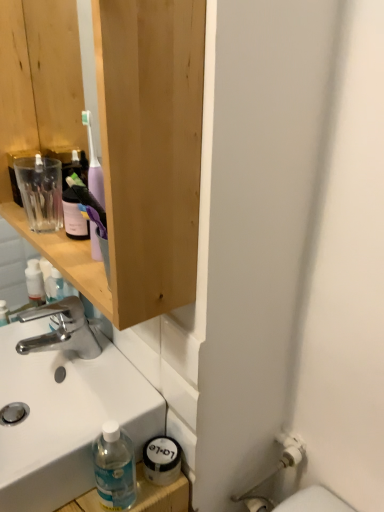
You are a GUI agent. You are given a task and a screenshot of the screen. Output one action in this format:
    pyautogui.click(x=<x>, y=<y>)
    Task: Click on the polished chrome faucet at center
    This screenshot has width=384, height=512.
    Given the screenshot: What is the action you would take?
    click(61, 330)

This screenshot has height=512, width=384. I want to click on white glossy sink at lower left, so click(65, 415).

Image resolution: width=384 pixels, height=512 pixels. Describe the element at coordinates (115, 139) in the screenshot. I see `wooden cabinet at upper left` at that location.

You are a GUI agent. You are given a task and a screenshot of the screen. Output one action in this format:
    pyautogui.click(x=<x>, y=<y>)
    Task: Click on the polished chrome faucet at center
    The width and height of the screenshot is (384, 512).
    Given the screenshot: What is the action you would take?
    pyautogui.click(x=61, y=330)

Is polished chrome faucet at center positioned beyond the bounds of wooden cabinet at upper left?

Indeed, polished chrome faucet at center is completely outside wooden cabinet at upper left.

Is polished chrome faucet at center wider than wooden cabinet at upper left?

In fact, polished chrome faucet at center might be narrower than wooden cabinet at upper left.

Is polished chrome faucet at center in contact with wooden cabinet at upper left?

polished chrome faucet at center and wooden cabinet at upper left are not in contact.

Is polished chrome faucet at center to the left of white glossy sink at lower left from the viewer's perspective?

In fact, polished chrome faucet at center is to the right of white glossy sink at lower left.

Considering the relative positions of polished chrome faucet at center and white glossy sink at lower left in the image provided, is polished chrome faucet at center in front of white glossy sink at lower left?

No, polished chrome faucet at center is further to the viewer.

In the scene shown: From the image's perspective, which object appears higher, polished chrome faucet at center or white glossy sink at lower left?

polished chrome faucet at center is shown above in the image.

Is white glossy sink at lower left at the back of polished chrome faucet at center?

That's not correct — polished chrome faucet at center is not looking away from white glossy sink at lower left.

Considering the positions of objects white glossy sink at lower left and wooden cabinet at upper left in the image provided, who is more to the right, white glossy sink at lower left or wooden cabinet at upper left?

Positioned to the right is wooden cabinet at upper left.

The image size is (384, 512). Identify the location of sink behind the wooden cabinet at upper left. click(65, 415).

How different are the orientations of white glossy sink at lower left and wooden cabinet at upper left in degrees?

0.314 degrees separate the facing orientations of white glossy sink at lower left and wooden cabinet at upper left.

Considering the positions of objects white glossy sink at lower left and wooden cabinet at upper left in the image provided, who is behind, white glossy sink at lower left or wooden cabinet at upper left?

Positioned behind is white glossy sink at lower left.

Considering the sizes of objects white glossy sink at lower left and polished chrome faucet at center in the image provided, who is taller, white glossy sink at lower left or polished chrome faucet at center?

polished chrome faucet at center is taller.

From a real-world perspective, does white glossy sink at lower left sit lower than polished chrome faucet at center?

Yes, from a real-world perspective, white glossy sink at lower left is below polished chrome faucet at center.

This screenshot has height=512, width=384. What are the coordinates of `tap above the white glossy sink at lower left (from a real-world perspective)` in the screenshot? It's located at (61, 330).

Is the depth of white glossy sink at lower left less than that of polished chrome faucet at center?

Yes, it is.

From a real-world perspective, is wooden cabinet at upper left physically below white glossy sink at lower left?

No, from a real-world perspective, wooden cabinet at upper left is not beneath white glossy sink at lower left.

Based on the photo, which object is positioned more to the left, wooden cabinet at upper left or white glossy sink at lower left?

From the viewer's perspective, white glossy sink at lower left appears more on the left side.

Is wooden cabinet at upper left positioned before white glossy sink at lower left?

Yes, wooden cabinet at upper left is in front of white glossy sink at lower left.

Would you say wooden cabinet at upper left is inside or outside polished chrome faucet at center?

wooden cabinet at upper left is outside polished chrome faucet at center.

Which is in front, point (79, 103) or point (79, 330)?

The point (79, 330) is more forward.

Considering the sizes of objects wooden cabinet at upper left and polished chrome faucet at center in the image provided, who is thinner, wooden cabinet at upper left or polished chrome faucet at center?

polished chrome faucet at center is thinner.

The image size is (384, 512). Find the location of `tap that appears below the wooden cabinet at upper left (from a real-world perspective)`. tap that appears below the wooden cabinet at upper left (from a real-world perspective) is located at coordinates (61, 330).

Find the location of a particular element. This screenshot has width=384, height=512. tap on the left of wooden cabinet at upper left is located at coordinates (61, 330).

The height and width of the screenshot is (512, 384). Find the location of `sink in front of the polished chrome faucet at center`. sink in front of the polished chrome faucet at center is located at coordinates (65, 415).

Considering their positions, is polished chrome faucet at center positioned closer to wooden cabinet at upper left than white glossy sink at lower left?

white glossy sink at lower left is positioned closer to the anchor wooden cabinet at upper left.

Based on their spatial positions, is white glossy sink at lower left or polished chrome faucet at center closer to wooden cabinet at upper left?

The object closer to wooden cabinet at upper left is white glossy sink at lower left.

Estimate the real-world distances between objects in this image. Which object is further from white glossy sink at lower left, polished chrome faucet at center or wooden cabinet at upper left?

wooden cabinet at upper left lies further to white glossy sink at lower left than the other object.

When comparing their distances from polished chrome faucet at center, does white glossy sink at lower left or wooden cabinet at upper left seem further?

wooden cabinet at upper left.

From the image, which object appears to be nearer to white glossy sink at lower left, wooden cabinet at upper left or polished chrome faucet at center?

polished chrome faucet at center is closer to white glossy sink at lower left.

Considering their positions, is wooden cabinet at upper left positioned further to polished chrome faucet at center than white glossy sink at lower left?

The object further to polished chrome faucet at center is wooden cabinet at upper left.

At what (x,y) coordinates should I click in order to perform the action: click on tap between wooden cabinet at upper left and white glossy sink at lower left in the up-down direction. Please return your answer as a coordinate pair (x, y). The width and height of the screenshot is (384, 512). Looking at the image, I should click on (61, 330).